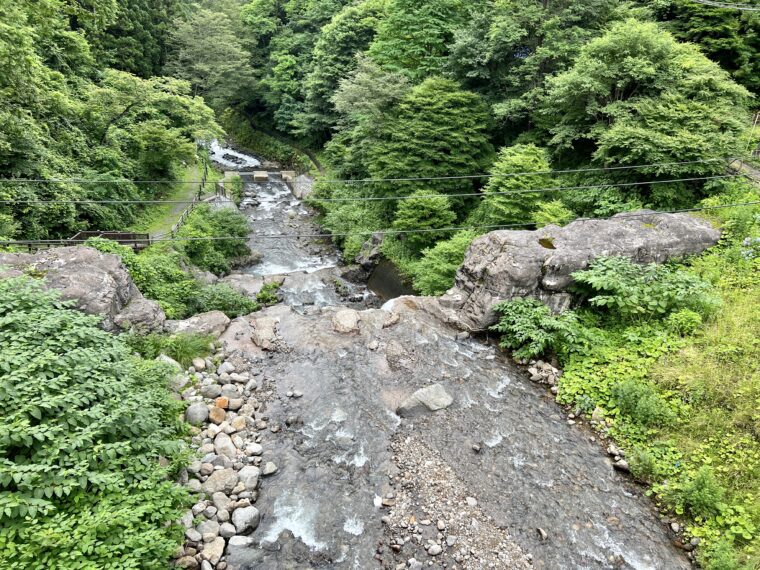
Locate an element on the screen. This screenshot has height=570, width=760. stairway is located at coordinates (122, 235).